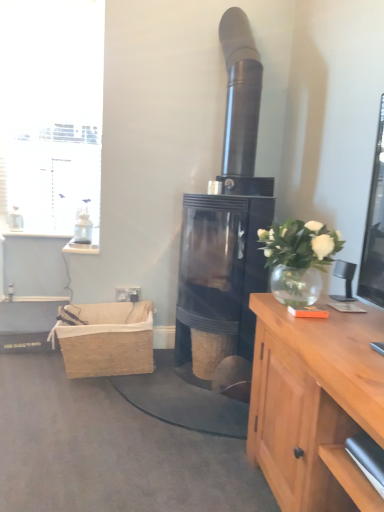
Question: From the image's perspective, relative to black glass fireplace at center, is white glass vase at upper right above or below?

Choices:
 (A) below
 (B) above

Answer: (A)

Question: Is white glass vase at upper right situated inside black glass fireplace at center or outside?

Choices:
 (A) outside
 (B) inside

Answer: (A)

Question: Which of these objects is positioned farthest from the black glass fireplace at center?

Choices:
 (A) white glass window at upper left
 (B) white plastic power outlet at center
 (C) white glass vase at upper right
 (D) woven brown basket at center
 (E) burlap picnic basket at lower left

Answer: (A)

Question: Based on their relative distances, which object is farther from the white glass vase at upper right?

Choices:
 (A) black glass fireplace at center
 (B) white plastic power outlet at center
 (C) burlap picnic basket at lower left
 (D) white glass window at upper left
 (E) woven brown basket at center

Answer: (D)